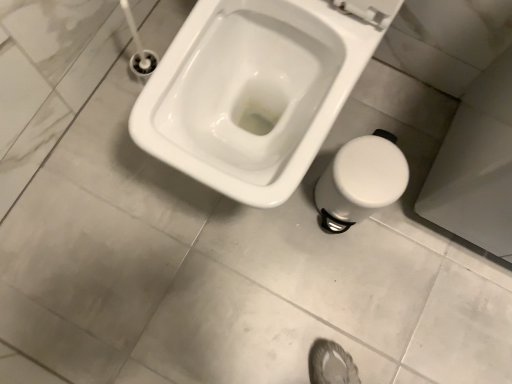
Find the location of a particular element. Image resolution: width=512 pixels, height=384 pixels. vacant space that's between white glossy toilet at center and white plastic bidet at lower right is located at coordinates (340, 144).